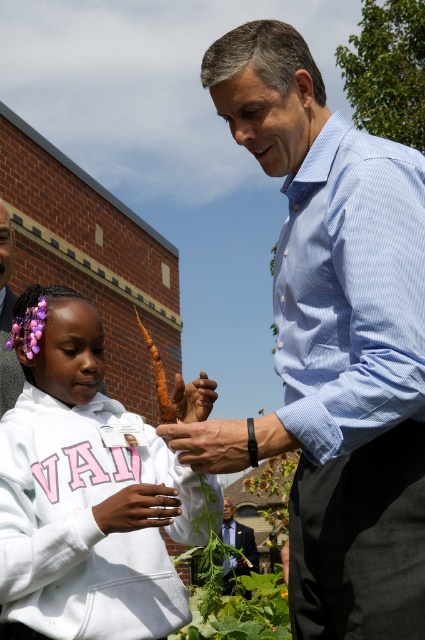
Consider the image. Based on the scene description, what is the 2D coordinate of the light blue striped shirt at center?

The light blue striped shirt at center is located at the 2D coordinate point of (337, 339).

You are a photographer trying to capture a closeup of the light blue striped shirt at center and the brown leather hand at center. Which object should you focus on first to ensure both are in sharp focus?

The light blue striped shirt at center is closer to the viewer than the brown leather hand at center, so focus on the light blue striped shirt at center first to ensure both are in sharp focus.